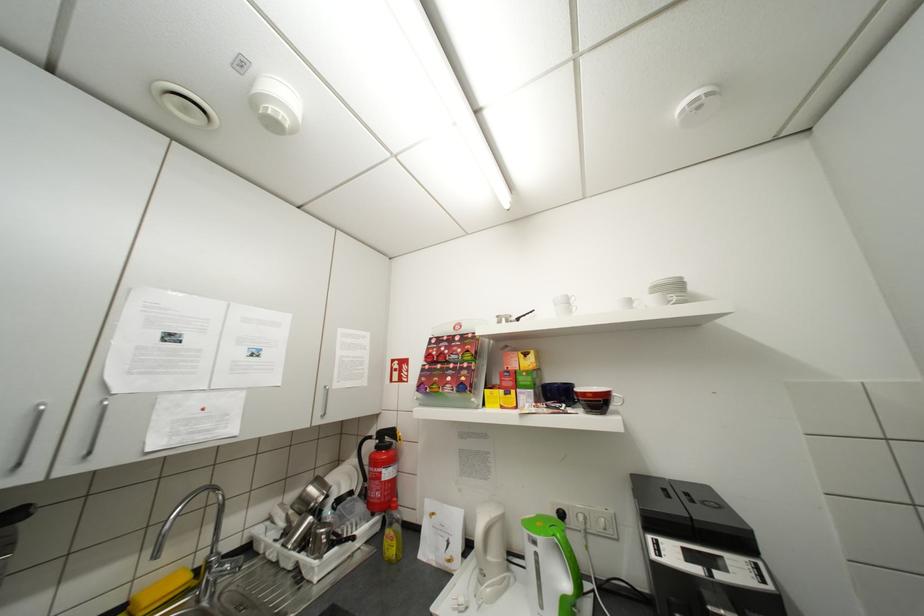
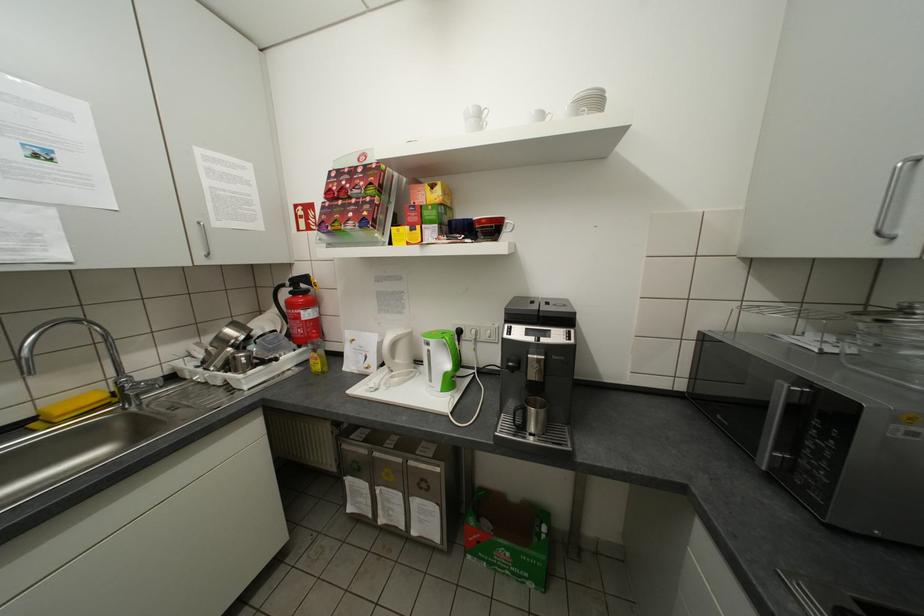
Find the pixel in the second image that matches point 393,469 in the first image.

(310, 312)